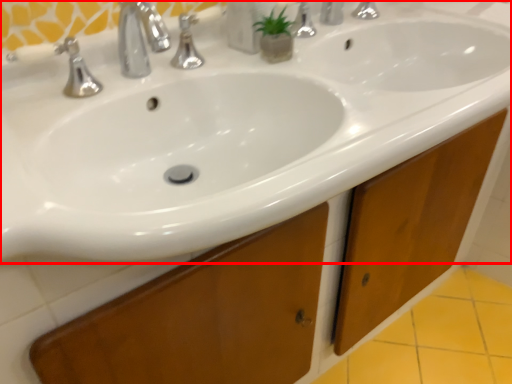
Question: From the image's perspective, considering the relative positions of sink (annotated by the red box) and soap dispenser in the image provided, where is sink (annotated by the red box) located with respect to the staircase?

Choices:
 (A) above
 (B) below

Answer: (B)